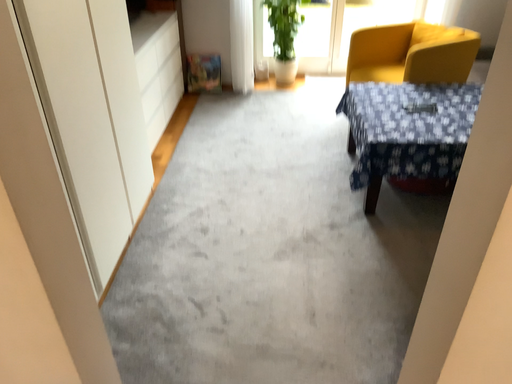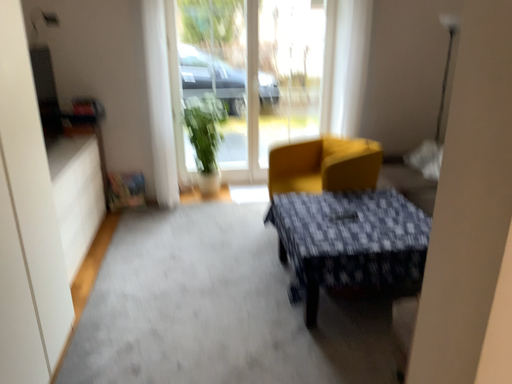
Question: Which way did the camera rotate in the video?

Choices:
 (A) rotated right
 (B) rotated left

Answer: (A)